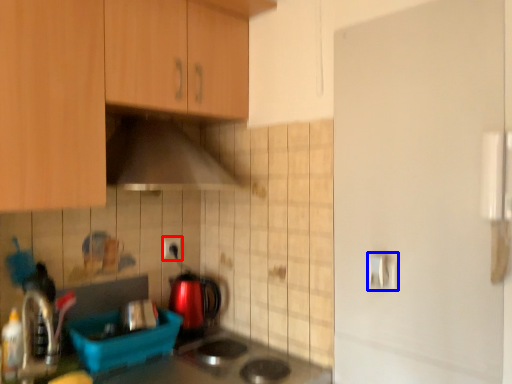
Question: Which object appears closest to the camera in this image, electric outlet (highlighted by a red box) or door handle (highlighted by a blue box)?

Choices:
 (A) electric outlet
 (B) door handle

Answer: (B)